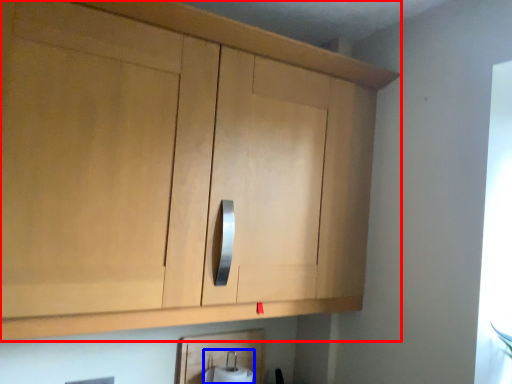
Question: Which object is further to the camera taking this photo, cabinetry (highlighted by a red box) or toilet paper (highlighted by a blue box)?

Choices:
 (A) cabinetry
 (B) toilet paper

Answer: (B)